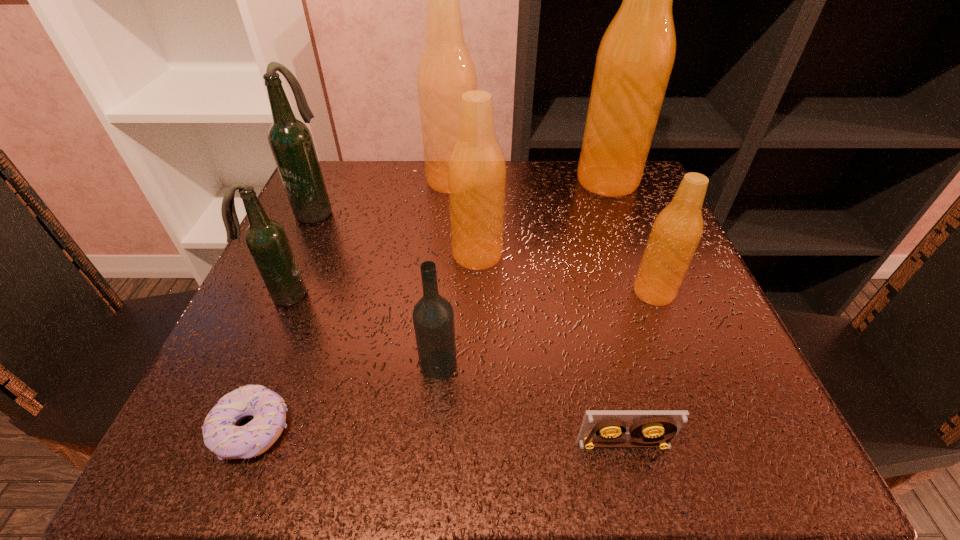
Identify the location of beer bottle that is the fifth closest to the nearer dark beer bottle. (636, 55).

Identify which tan beer bottle is located as the second nearest to the bigger dark beer bottle. Please provide its 2D coordinates. Your answer should be formatted as a tuple, i.e. [(x, y)], where the tuple contains the x and y coordinates of a point satisfying the conditions above.

[(476, 168)]

Choose which tan beer bottle is the second nearest neighbor to the smaller dark beer bottle. Please provide its 2D coordinates. Your answer should be formatted as a tuple, i.e. [(x, y)], where the tuple contains the x and y coordinates of a point satisfying the conditions above.

[(446, 70)]

Where is `blank space that satisfies the following two spatial constraints: 1. on the back side of the third nearest beer bottle; 2. on the left side of the vodka`? blank space that satisfies the following two spatial constraints: 1. on the back side of the third nearest beer bottle; 2. on the left side of the vodka is located at coordinates (447, 254).

Identify the location of vacant space that satisfies the following two spatial constraints: 1. on the front side of the bigger dark beer bottle; 2. on the right side of the sixth nearest object. (296, 254).

In order to click on free spot that satisfies the following two spatial constraints: 1. on the back side of the second smallest tan beer bottle; 2. on the right side of the black vodka in this screenshot , I will do `click(447, 254)`.